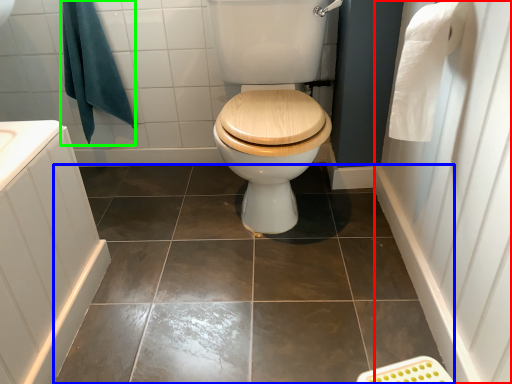
Question: Which is nearer to the side (highlighted by a red box)? ceramic tile (highlighted by a blue box) or bath towel (highlighted by a green box).

Choices:
 (A) ceramic tile
 (B) bath towel

Answer: (A)